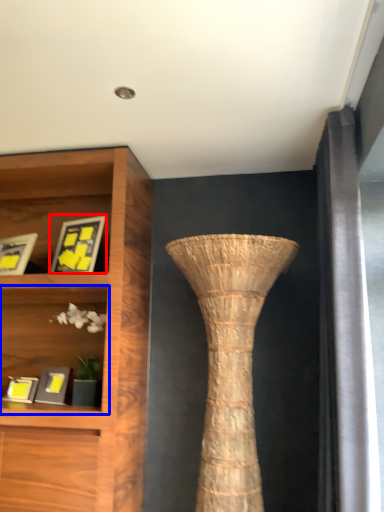
Question: Which object is closer to the camera taking this photo, picture frame (highlighted by a red box) or shelf (highlighted by a blue box)?

Choices:
 (A) picture frame
 (B) shelf

Answer: (B)